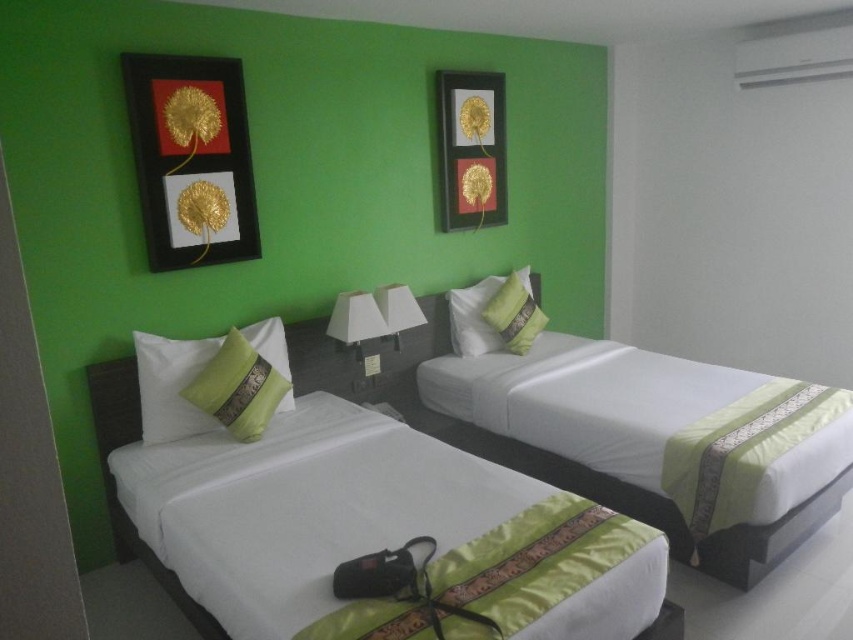
What do you see at coordinates (572, 480) in the screenshot?
I see `white satin bed at center` at bounding box center [572, 480].

What are the coordinates of `white satin bed at center` in the screenshot? It's located at (572, 480).

Can you confirm if white satin bed at center is positioned below gold leaf picture frame at upper center?

Indeed, white satin bed at center is positioned under gold leaf picture frame at upper center.

Is point (650, 509) closer to viewer compared to point (477, 129)?

Yes, it is in front of point (477, 129).

At what (x,y) coordinates should I click in order to perform the action: click on white satin bed at center. Please return your answer as a coordinate pair (x, y). Looking at the image, I should click on (572, 480).

Who is higher up, white satin bed at center or green satin pillow at left?

green satin pillow at left

In the scene shown: Which is below, white satin bed at center or green satin pillow at left?

white satin bed at center is lower down.

Does point (657, 525) come farther from viewer compared to point (177, 353)?

No, (657, 525) is in front of (177, 353).

The width and height of the screenshot is (853, 640). Identify the location of white satin bed at center. [572, 480].